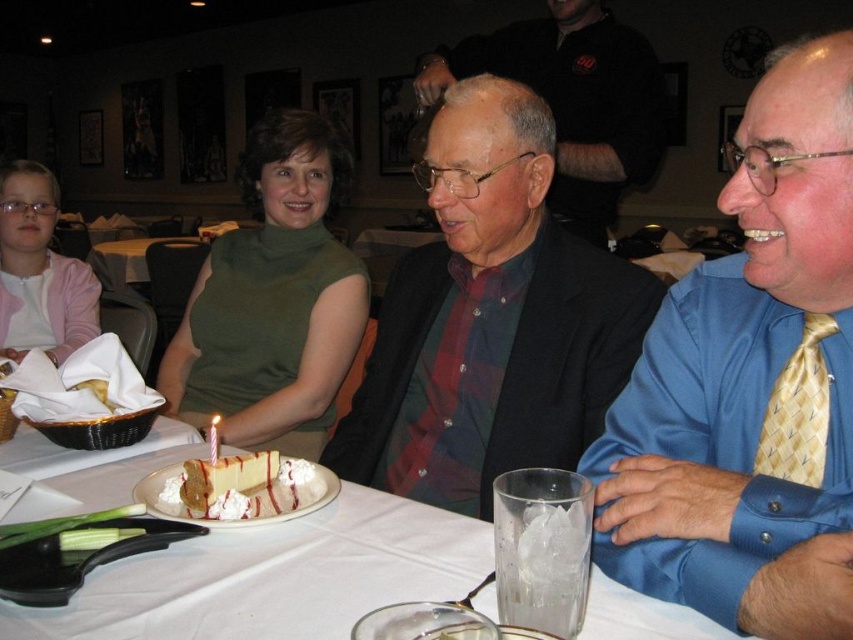
Question: Among these points, which one is nearest to the camera?

Choices:
 (A) (848, 410)
 (B) (253, 452)
 (C) (207, 451)
 (D) (778, 422)

Answer: (A)

Question: Is blue satin shirt at center above vanilla sponge cake with whipped cream at center?

Choices:
 (A) yes
 (B) no

Answer: (A)

Question: Which of the following is the farthest from the observer?

Choices:
 (A) white paper birthday candle at center
 (B) matte black suit at center

Answer: (B)

Question: Is blue satin shirt at center closer to the viewer compared to vanilla sponge cake with whipped cream at center?

Choices:
 (A) yes
 (B) no

Answer: (A)

Question: Does vanilla sponge cake with whipped cream at center have a lesser width compared to white paper birthday candle at center?

Choices:
 (A) no
 (B) yes

Answer: (A)

Question: Which point is farther to the camera?

Choices:
 (A) (808, 397)
 (B) (366, 298)

Answer: (B)